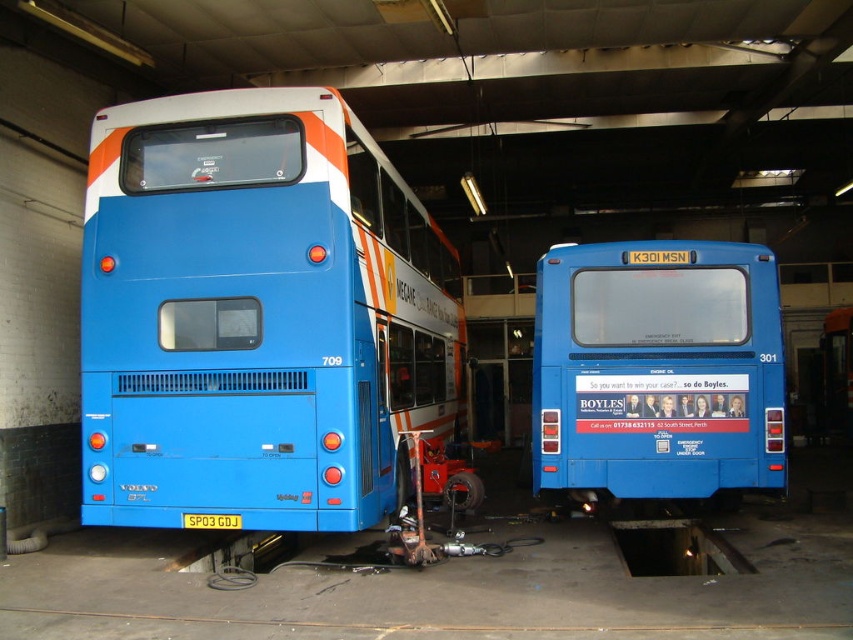
Question: Can you confirm if blue matte bus at left is positioned to the left of blue matte bus at center?

Choices:
 (A) no
 (B) yes

Answer: (B)

Question: Among these points, which one is nearest to the camera?

Choices:
 (A) (711, 273)
 (B) (177, 484)

Answer: (B)

Question: Does blue matte bus at left have a smaller size compared to blue matte bus at center?

Choices:
 (A) no
 (B) yes

Answer: (B)

Question: Which point appears farthest from the camera in this image?

Choices:
 (A) (207, 289)
 (B) (669, 371)

Answer: (B)

Question: Which object is closer to the camera taking this photo?

Choices:
 (A) blue matte bus at left
 (B) blue matte bus at center

Answer: (A)

Question: Is the position of blue matte bus at left more distant than that of blue matte bus at center?

Choices:
 (A) yes
 (B) no

Answer: (B)